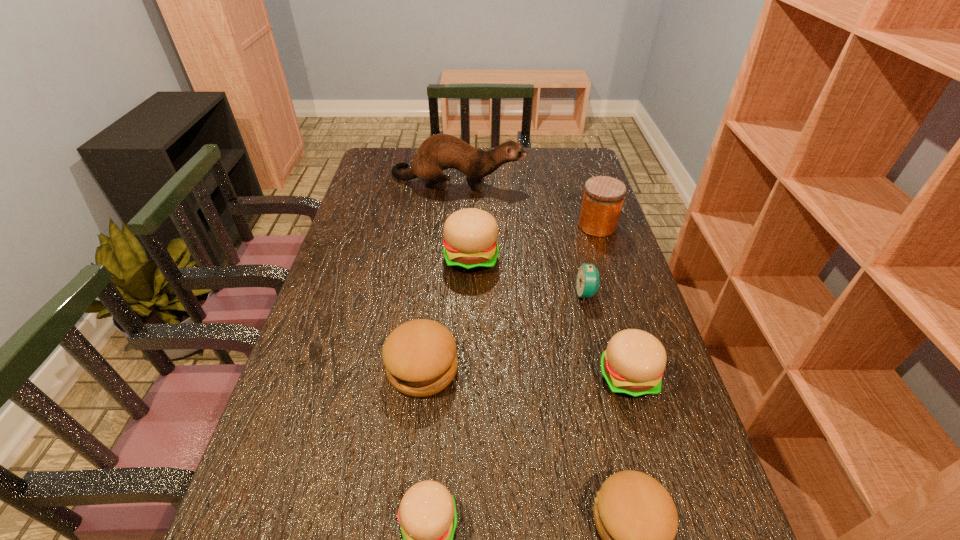
The width and height of the screenshot is (960, 540). In order to click on the fifth nearest object in this screenshot , I will do `click(587, 279)`.

Image resolution: width=960 pixels, height=540 pixels. I want to click on blue alarm clock, so tap(587, 279).

Identify the location of free spot located 0.140m at the face of the farthest object. Image resolution: width=960 pixels, height=540 pixels. (563, 180).

Locate an element on the screen. The image size is (960, 540). vacant space located 0.280m on the front of the second farthest object is located at coordinates (622, 303).

In order to click on vacant region located 0.200m on the right of the farthest beige hamburger in this screenshot , I will do `click(567, 258)`.

The width and height of the screenshot is (960, 540). I want to click on blank space located on the front of the second smallest beige hamburger, so click(672, 532).

At what (x,y) coordinates should I click in order to perform the action: click on vacant point located 0.170m on the left of the bigger brown hamburger. Please return your answer as a coordinate pair (x, y). Looking at the image, I should click on (312, 368).

Where is `vacant space located on the front-facing side of the alarm clock`? vacant space located on the front-facing side of the alarm clock is located at coordinates (505, 294).

You are a GUI agent. You are given a task and a screenshot of the screen. Output one action in this format:
    pyautogui.click(x=<x>, y=<y>)
    Task: Click on the free space located on the front-facing side of the alarm clock
    This screenshot has height=540, width=960.
    Given the screenshot: What is the action you would take?
    [509, 294]

Where is `vacant space located on the front-facing side of the alarm clock`? The height and width of the screenshot is (540, 960). vacant space located on the front-facing side of the alarm clock is located at coordinates (509, 294).